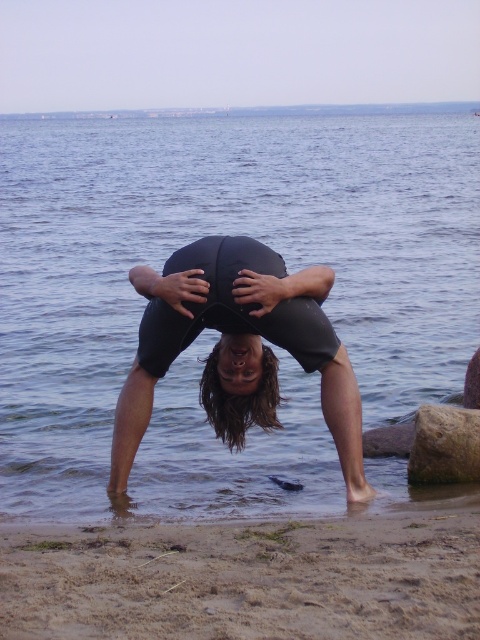
Can you confirm if blue water at center is taller than black matte squat at center?

Indeed, blue water at center has a greater height compared to black matte squat at center.

Between point (131, 168) and point (220, 426), which one is positioned in front?

Point (220, 426) is in front.

Is point (155, 429) positioned behind point (251, 412)?

Yes, point (155, 429) is behind point (251, 412).

Identify the location of blue water at center. (227, 234).

Is brown sandy beach at lower left taller than black matte squat at center?

Incorrect, brown sandy beach at lower left's height is not larger of black matte squat at center's.

Which of these two, brown sandy beach at lower left or black matte squat at center, stands shorter?

brown sandy beach at lower left

Who is more forward, (228,541) or (203,256)?

Point (228,541)

Identify the location of brown sandy beach at lower left. Image resolution: width=480 pixels, height=640 pixels. (245, 577).

Does blue water at center appear under brown sandy beach at lower left?

No.

Does blue water at center have a greater height compared to brown sandy beach at lower left?

Correct, blue water at center is much taller as brown sandy beach at lower left.

Is point (362, 157) closer to viewer compared to point (269, 582)?

No, (362, 157) is behind (269, 582).

I want to click on blue water at center, so click(227, 234).